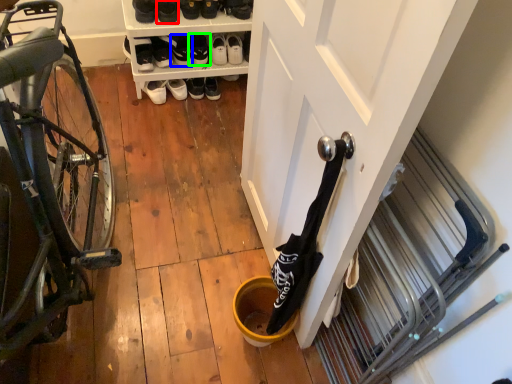
Question: Which object is the closest to the footwear (highlighted by a red box)? Choose among these: footwear (highlighted by a blue box) or footwear (highlighted by a green box).

Choices:
 (A) footwear
 (B) footwear

Answer: (A)